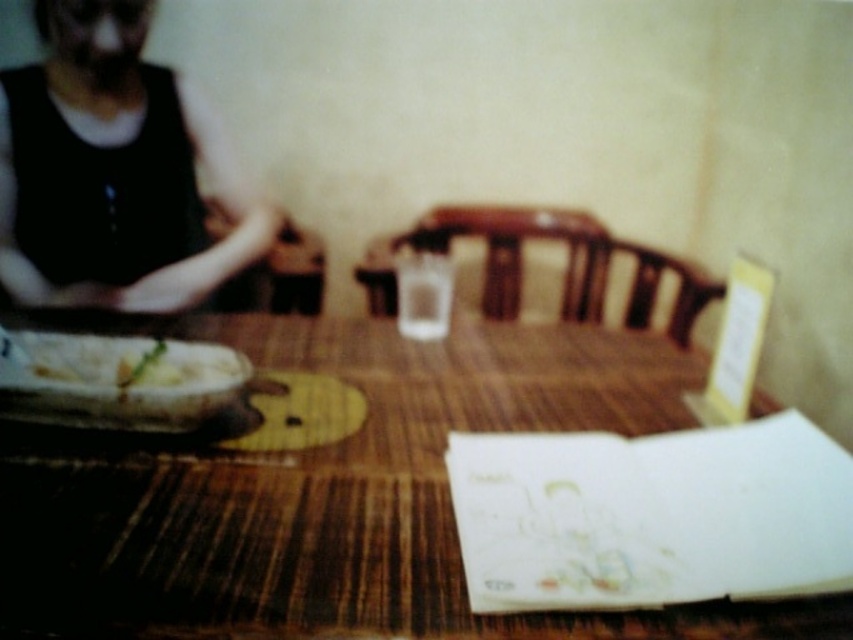
You are sitting at the wooden table at center and looking towards the black fabric at left. Which object is closer to you?

The wooden table at center is closer to you because it is below the black fabric at left, meaning the fabric is positioned above the table.